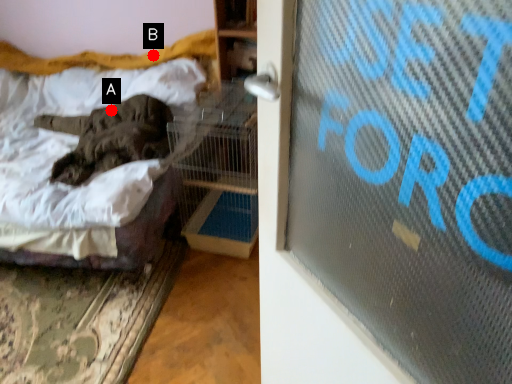
Question: Two points are circled on the image, labeled by A and B beside each circle. Which point appears closest to the camera in this image?

Choices:
 (A) A is closer
 (B) B is closer

Answer: (A)